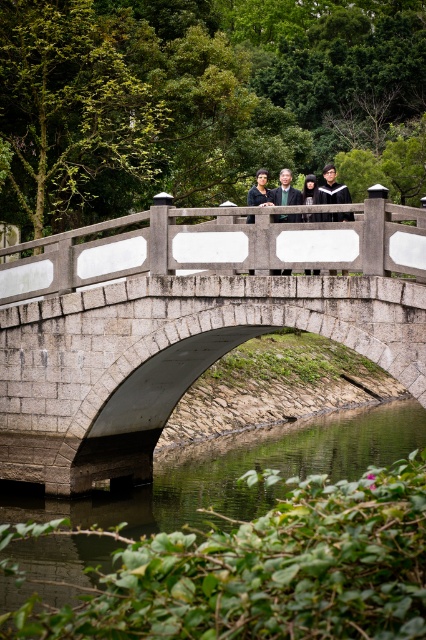
Is gray stone bridge at center in front of dark gray suit at center?

That is True.

Can you confirm if gray stone bridge at center is positioned above dark gray suit at center?

No, gray stone bridge at center is not above dark gray suit at center.

Is point (91, 426) behind point (291, 188)?

No, (91, 426) is in front of (291, 188).

What are the coordinates of `gray stone bridge at center` in the screenshot? It's located at (184, 323).

Find the location of a particular element. gray stone bridge at center is located at coordinates [x=184, y=323].

Which is in front, point (158, 288) or point (285, 195)?

Point (158, 288) is in front.

Who is more forward, (11,449) or (302,216)?

Positioned in front is point (302,216).

Where is `gray stone bridge at center`? The width and height of the screenshot is (426, 640). gray stone bridge at center is located at coordinates (184, 323).

Is point (354, 554) farther from viewer compared to point (285, 179)?

That is False.

Which is below, smooth concrete water at center or dark gray suit at center?

smooth concrete water at center is lower down.

Describe the element at coordinates (249, 544) in the screenshot. Image resolution: width=426 pixels, height=640 pixels. I see `smooth concrete water at center` at that location.

The image size is (426, 640). Identify the location of smooth concrete water at center. tap(249, 544).